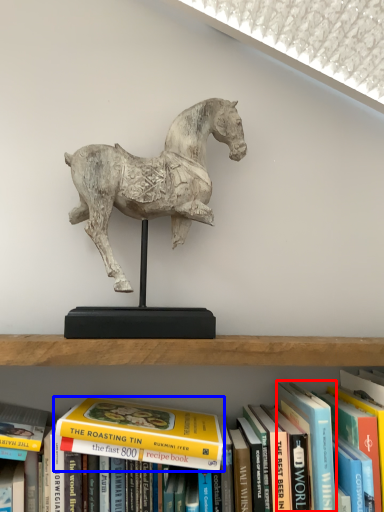
Question: Which object appears closest to the camera in this image, paperback book (highlighted by a red box) or book (highlighted by a blue box)?

Choices:
 (A) paperback book
 (B) book

Answer: (A)